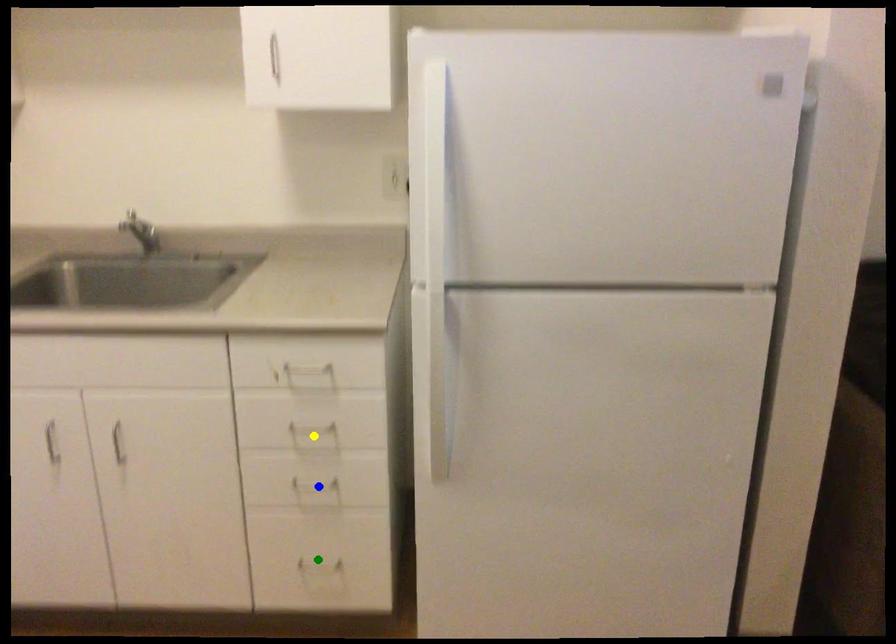
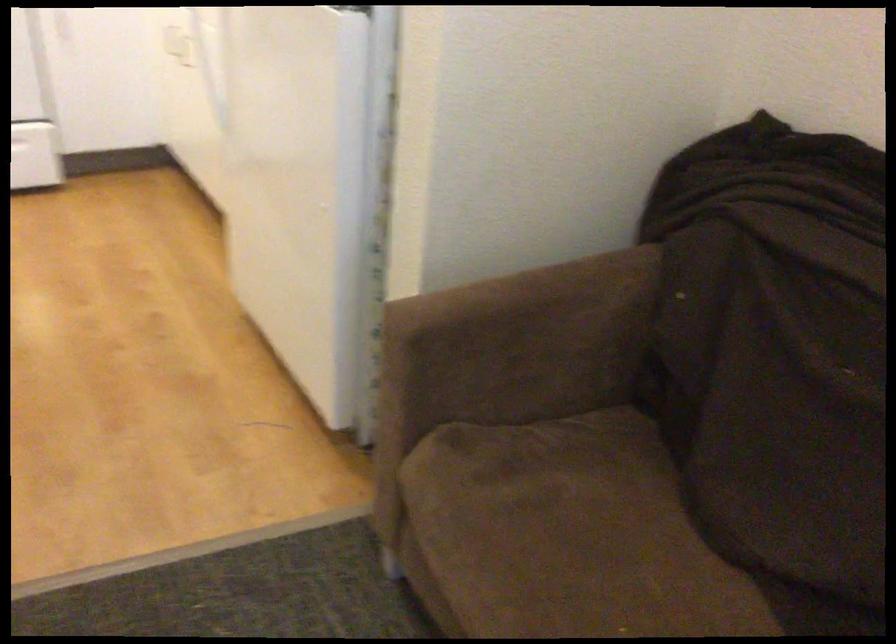
I am providing you with two images of the same scene from different viewpoints. Three points are marked in image1. Which point corresponds to a part or object that is occluded in image2?In image1, three points are marked. Which of them correspond to a part or object that is occluded in image2?Among the three points shown in image1, which one corresponds to a part or object that is no longer visible due to occlusion in image2?

Invisible in image2: blue point, yellow point, green point.